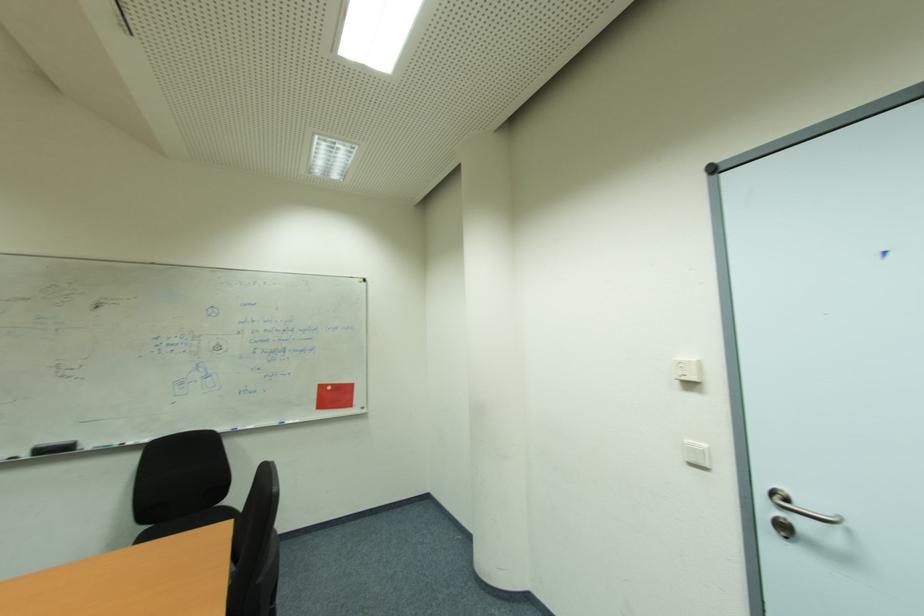
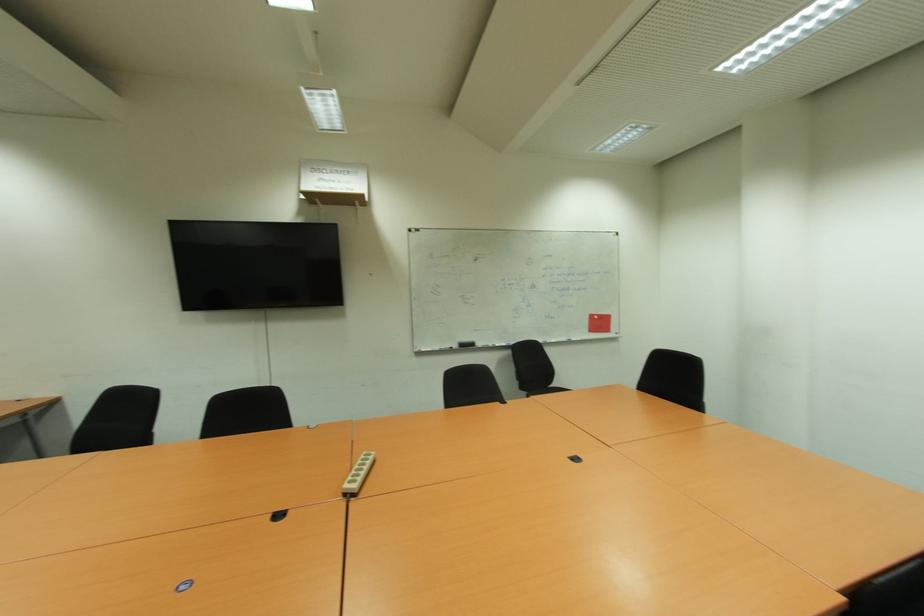
The images are taken continuously from a first-person perspective. In which direction are you moving?

The movement direction of the cameraman is left, backward.